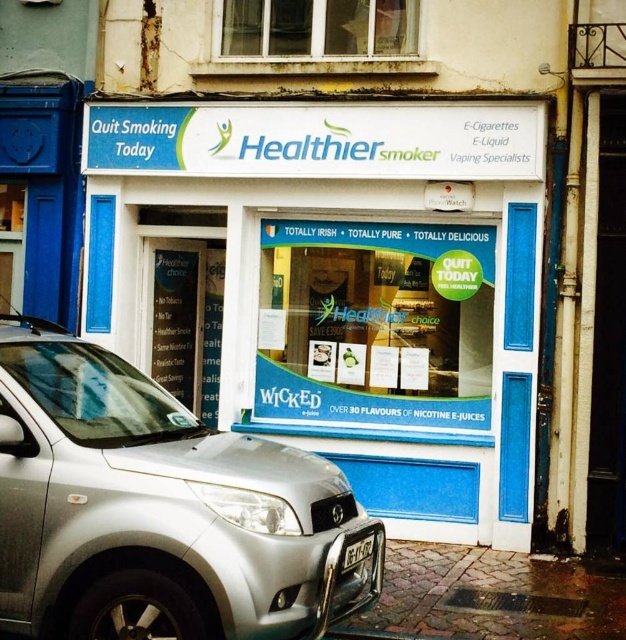
Who is positioned more to the left, white plastic storefront at center or silver metallic car at lower left?

From the viewer's perspective, silver metallic car at lower left appears more on the left side.

Is white plastic storefront at center taller than silver metallic car at lower left?

Correct, white plastic storefront at center is much taller as silver metallic car at lower left.

Is point (146, 152) closer to viewer compared to point (78, 365)?

That is False.

The height and width of the screenshot is (640, 626). Identify the location of white plastic storefront at center. (349, 284).

Can you confirm if silver metallic car at lower left is positioned below white plastic license plate at lower center?

No, silver metallic car at lower left is not below white plastic license plate at lower center.

Between point (313, 628) and point (361, 541), which one is positioned behind?

The point (361, 541) is more distant.

Based on the photo, who is more distant from viewer, (212, 490) or (341, 564)?

Point (341, 564)

I want to click on silver metallic car at lower left, so click(158, 509).

Between point (299, 364) and point (361, 541), which one is positioned in front?

Point (361, 541) is in front.

Between white plastic storefront at center and white plastic license plate at lower center, which one has more height?

white plastic storefront at center

Is point (464, 384) farther from viewer compared to point (372, 541)?

Yes, it is.

At what (x,y) coordinates should I click in order to perform the action: click on white plastic storefront at center. Please return your answer as a coordinate pair (x, y). Image resolution: width=626 pixels, height=640 pixels. Looking at the image, I should click on (349, 284).